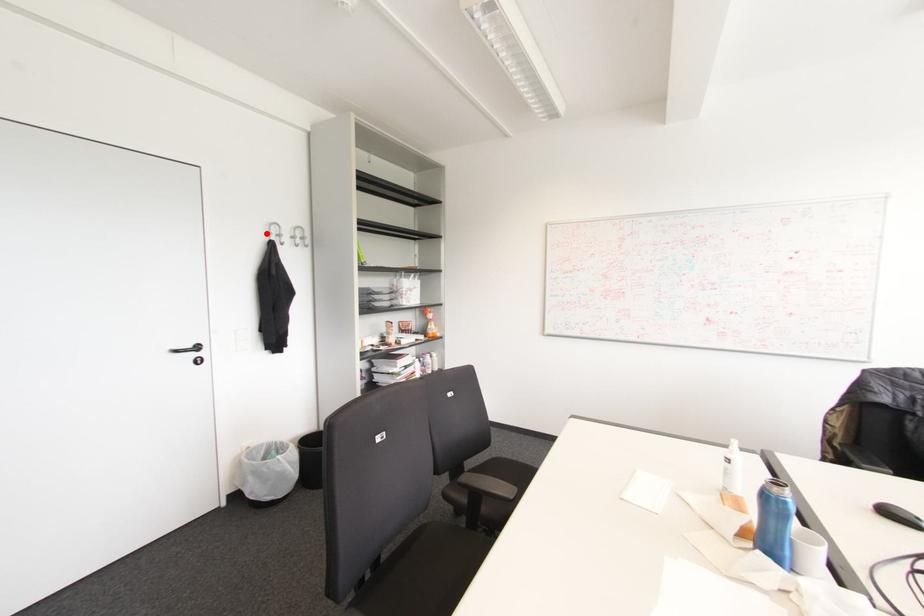
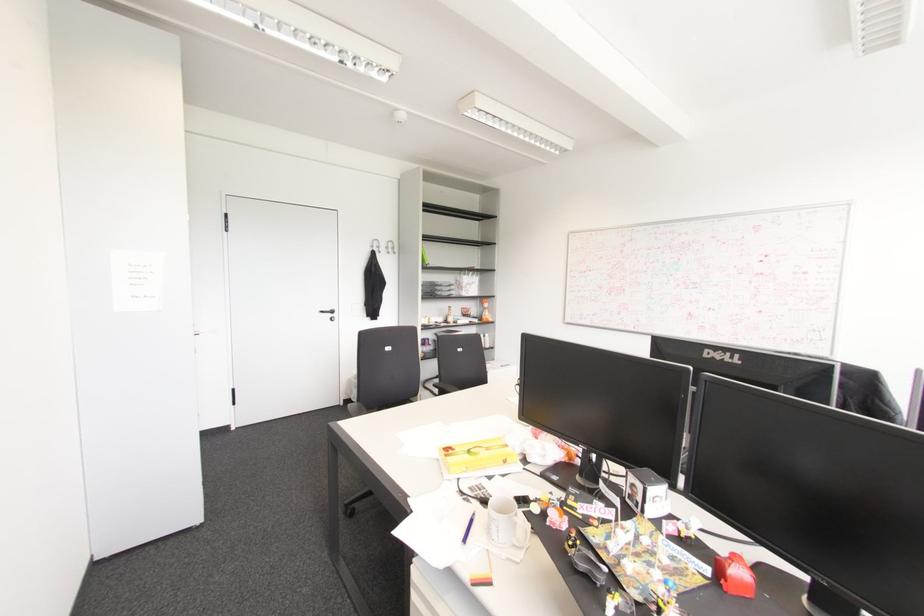
Find the pixel in the second image that matches the highlighted location in the first image.

(371, 246)